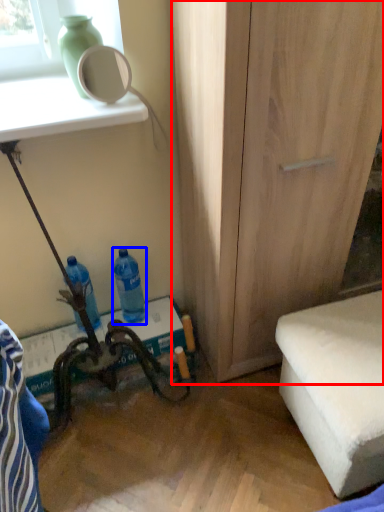
Question: Among these objects, which one is nearest to the camera, cabinetry (highlighted by a red box) or bottle (highlighted by a blue box)?

Choices:
 (A) cabinetry
 (B) bottle

Answer: (A)